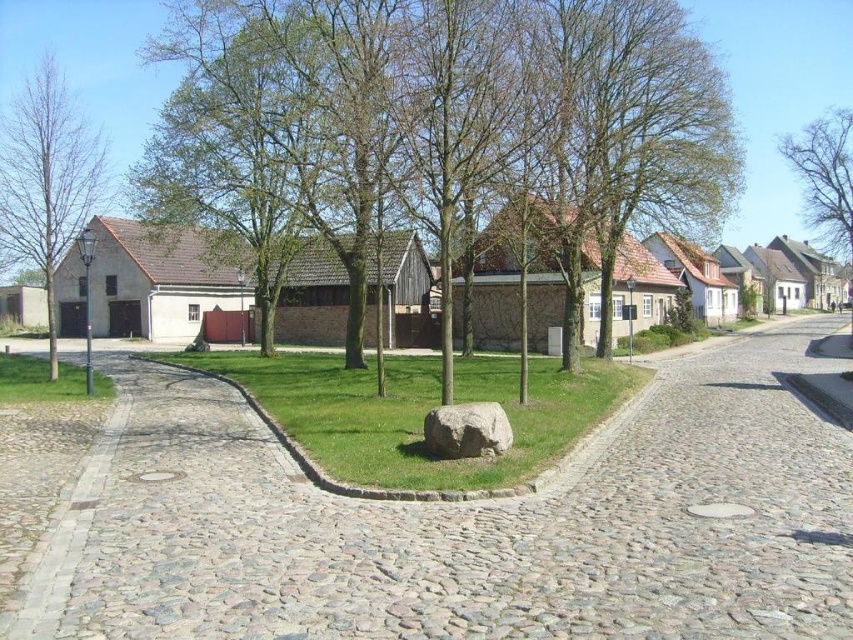
In the scene shown: You are a painter setting up your easel on the cobblestone street. You want to capture the contrast between the green leafy tree at center and the bare branches at upper right. Which tree has a wider spread of branches?

The green leafy tree at center has a wider spread of branches compared to the bare branches at upper right, as its width surpasses the latter.

You are an artist planning to paint the scene. You want to ensure the green leafy tree at center is proportionally accurate compared to the bare branches at upper right. Which object should you draw first to establish the correct scale?

The green leafy tree at center should be drawn first since it is taller than the bare branches at upper right, allowing you to set the proper scale for the smaller object.

You are a gardener planning to plant flowers on the green grass at center and gray rough stone at center. Which surface can you plant flowers on?

The green grass at center is suitable for planting flowers since it is located above the gray rough stone at center, indicating it is the grassy area where plants typically grow.